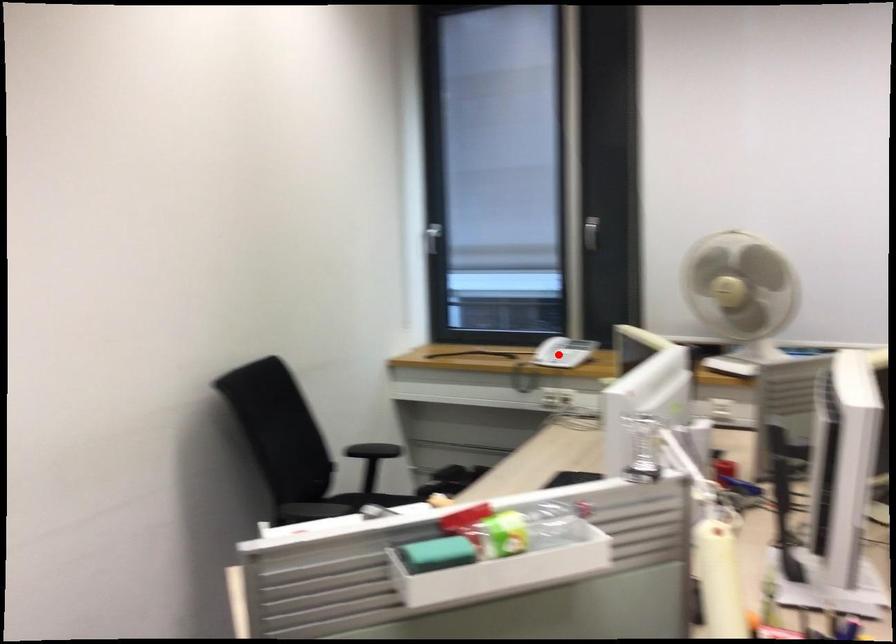
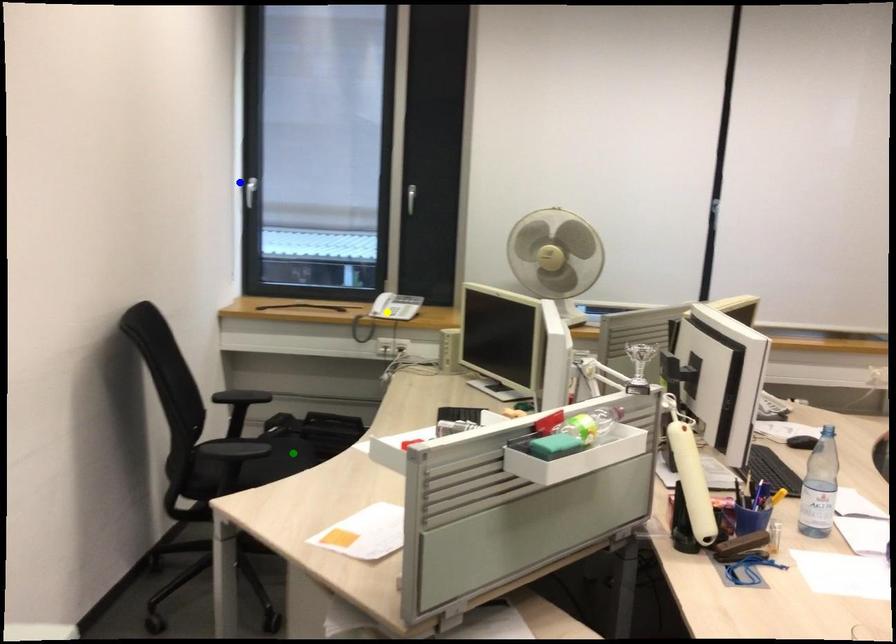
Question: I am providing you with two images of the same scene from different viewpoints. A red point is marked on the first image. You are given multiple points on the second image. In image 2, which mark is for the same physical point as the one in image 1?

Choices:
 (A) green point
 (B) blue point
 (C) yellow point

Answer: (C)